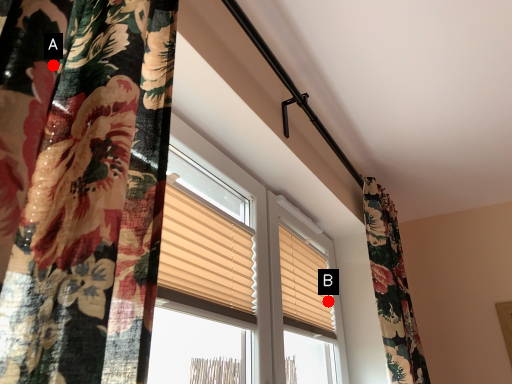
Question: Two points are circled on the image, labeled by A and B beside each circle. Which point is farther from the camera taking this photo?

Choices:
 (A) A is further
 (B) B is further

Answer: (B)